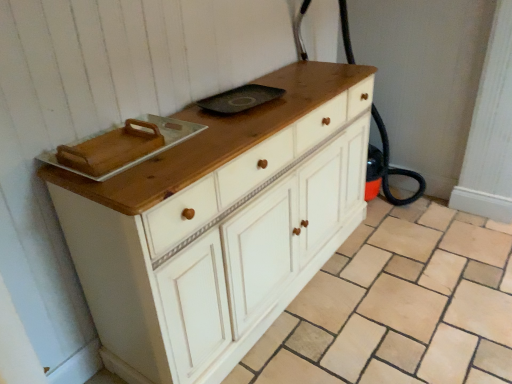
The image size is (512, 384). I want to click on vacant area located to the right-hand side of white wood chest of drawers at center, so click(415, 295).